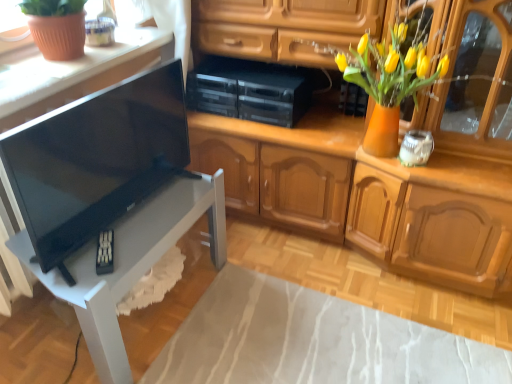
Question: Which direction should I rotate to face matte black speaker at upper center, the 2th appliance viewed from the right, — up or down?

Choices:
 (A) down
 (B) up

Answer: (B)

Question: Is black plastic stereo at center, the first appliance from the left, positioned behind matte white countertop at upper left?

Choices:
 (A) no
 (B) yes

Answer: (B)

Question: Does black plastic stereo at center, the first appliance from the left, have a smaller size compared to matte white countertop at upper left?

Choices:
 (A) yes
 (B) no

Answer: (A)

Question: Can you confirm if black plastic stereo at center, the third appliance positioned from the right, is shorter than matte white countertop at upper left?

Choices:
 (A) no
 (B) yes

Answer: (A)

Question: Is black plastic stereo at center, the third appliance positioned from the right, to the right of matte white countertop at upper left from the viewer's perspective?

Choices:
 (A) yes
 (B) no

Answer: (A)

Question: From a real-world perspective, is black plastic stereo at center, the third appliance positioned from the right, located beneath matte white countertop at upper left?

Choices:
 (A) yes
 (B) no

Answer: (A)

Question: Is black plastic stereo at center, the first appliance from the left, not inside matte white countertop at upper left?

Choices:
 (A) yes
 (B) no

Answer: (A)

Question: Does black glossy tv at left have a greater width compared to white glass jar at upper right, positioned as the 3th appliance in left-to-right order?

Choices:
 (A) yes
 (B) no

Answer: (B)

Question: Is black glossy tv at left turned away from white glass jar at upper right, positioned as the 3th appliance in left-to-right order?

Choices:
 (A) no
 (B) yes

Answer: (A)

Question: Is black glossy tv at left at the right side of white glass jar at upper right, positioned as the 3th appliance in left-to-right order?

Choices:
 (A) yes
 (B) no

Answer: (B)

Question: Is black glossy tv at left at the left side of white glass jar at upper right, positioned as the 3th appliance in left-to-right order?

Choices:
 (A) no
 (B) yes

Answer: (B)

Question: Is black glossy tv at left smaller than white glass jar at upper right, the first appliance positioned from the right?

Choices:
 (A) yes
 (B) no

Answer: (B)

Question: From a real-world perspective, is black glossy tv at left beneath white glass jar at upper right, the first appliance positioned from the right?

Choices:
 (A) yes
 (B) no

Answer: (B)

Question: Is matte black speaker at upper center, which is the 2th appliance from left to right, wider than black plastic stereo at center, the first appliance from the left?

Choices:
 (A) yes
 (B) no

Answer: (B)